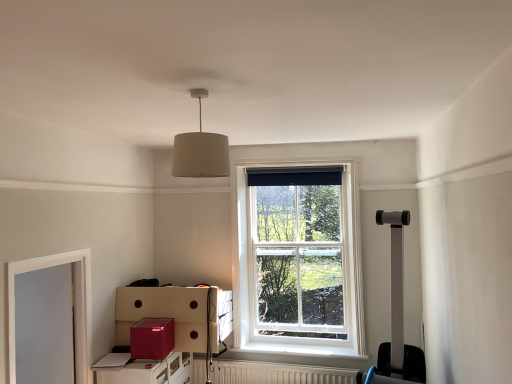
At what (x,y) coordinates should I click in order to perform the action: click on vacant space situated above beige fabric lampshade at upper center (from a real-world perspective). Please return your answer as a coordinate pair (x, y). Looking at the image, I should click on (195, 92).